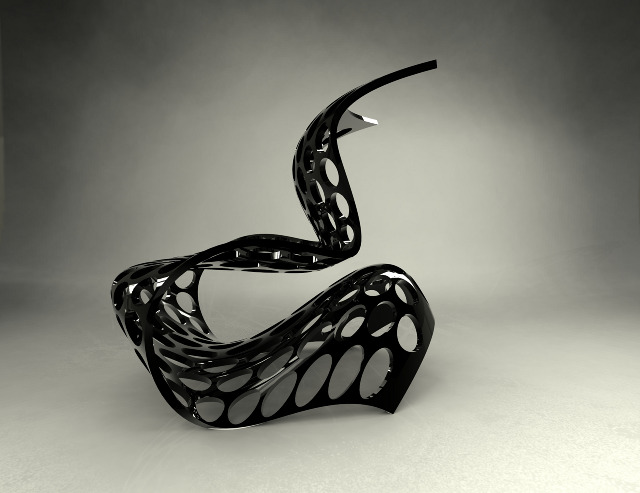
Find the location of `floor`. floor is located at coordinates (476, 417).